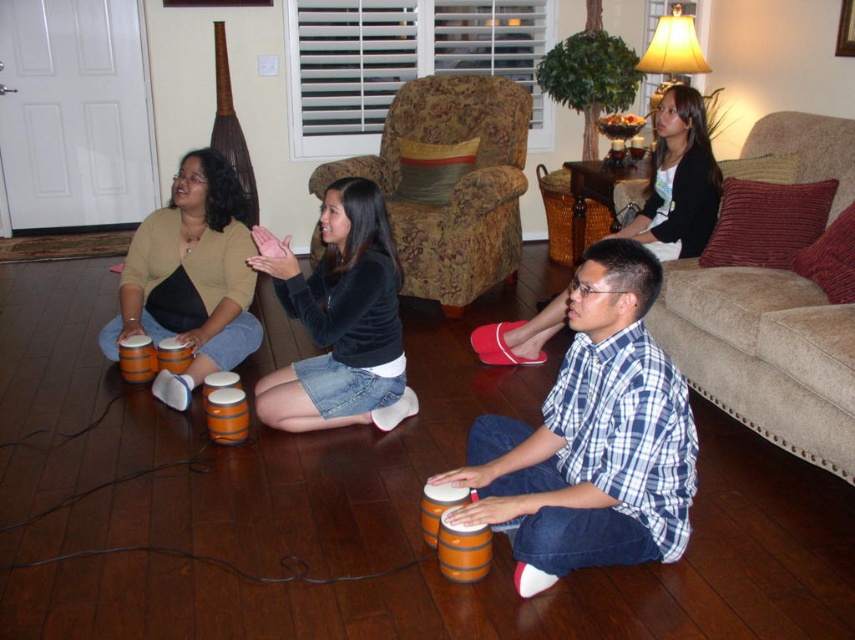
You are a photographer trying to capture a closeup of both the black matte skirt at center and the plaid cotton shirt at center. Given their sizes, which one should you zoom in on first to ensure both are in focus?

The black matte skirt at center is larger in size than the plaid cotton shirt at center, so you should zoom in on the plaid cotton shirt at center first to ensure both are in focus.

You are standing at point [219,301] and want to move to the living room entrance located at point [500,440]. Is the entrance directly in front of you?

Yes, the entrance at point [500,440] is directly in front of you because it is located in front of your current position at point [219,301].

You are a photographer setting up for a group photo. You notice two items at the center of the scene, the black matte skirt at center and the plaid cotton shirt at center. Which one is positioned to the left side of the other?

The black matte skirt at center is to the left of the plaid cotton shirt at center.